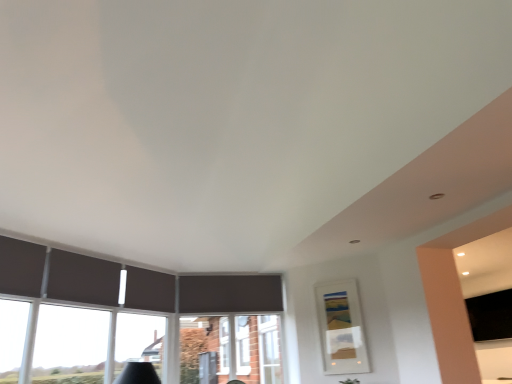
Question: Considering the relative sizes of transparent glass window at lower left and black matte tv at right in the image provided, is transparent glass window at lower left wider than black matte tv at right?

Choices:
 (A) no
 (B) yes

Answer: (A)

Question: From a real-world perspective, is transparent glass window at lower left on top of black matte tv at right?

Choices:
 (A) yes
 (B) no

Answer: (B)

Question: Does transparent glass window at lower left have a larger size compared to black matte tv at right?

Choices:
 (A) yes
 (B) no

Answer: (B)

Question: Considering the relative sizes of transparent glass window at lower left and black matte tv at right in the image provided, is transparent glass window at lower left thinner than black matte tv at right?

Choices:
 (A) no
 (B) yes

Answer: (B)

Question: Can you confirm if transparent glass window at lower left is smaller than black matte tv at right?

Choices:
 (A) yes
 (B) no

Answer: (A)

Question: Considering the relative positions of transparent glass window at lower left and matte white picture frame at center-right in the image provided, is transparent glass window at lower left to the left or to the right of matte white picture frame at center-right?

Choices:
 (A) right
 (B) left

Answer: (B)

Question: Considering the positions of point (159, 354) and point (322, 283), is point (159, 354) closer or farther from the camera than point (322, 283)?

Choices:
 (A) farther
 (B) closer

Answer: (B)

Question: From a real-world perspective, is transparent glass window at lower left above or below matte white picture frame at center-right?

Choices:
 (A) below
 (B) above

Answer: (B)

Question: Is transparent glass window at lower left in front of or behind matte white picture frame at center-right in the image?

Choices:
 (A) front
 (B) behind

Answer: (A)

Question: From the image's perspective, relative to transparent glass window at lower left, is black matte tv at right above or below?

Choices:
 (A) above
 (B) below

Answer: (B)

Question: Looking at their shapes, would you say black matte tv at right is wider or thinner than transparent glass window at lower left?

Choices:
 (A) wide
 (B) thin

Answer: (A)

Question: Looking at the image, does black matte tv at right seem bigger or smaller compared to transparent glass window at lower left?

Choices:
 (A) small
 (B) big

Answer: (B)

Question: Is point (489, 324) positioned closer to the camera than point (116, 331)?

Choices:
 (A) closer
 (B) farther

Answer: (A)

Question: Relative to black matte tv at right, is transparent glass window at lower left in front or behind?

Choices:
 (A) behind
 (B) front

Answer: (B)

Question: Choose the correct answer: Is transparent glass window at lower left inside black matte tv at right or outside it?

Choices:
 (A) inside
 (B) outside

Answer: (B)